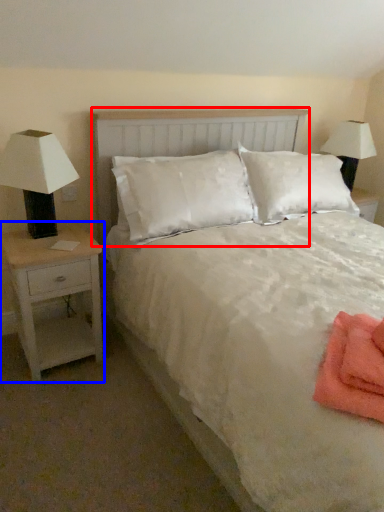
Question: Which point is further to the camera, headboard (highlighted by a red box) or nightstand (highlighted by a blue box)?

Choices:
 (A) headboard
 (B) nightstand

Answer: (B)